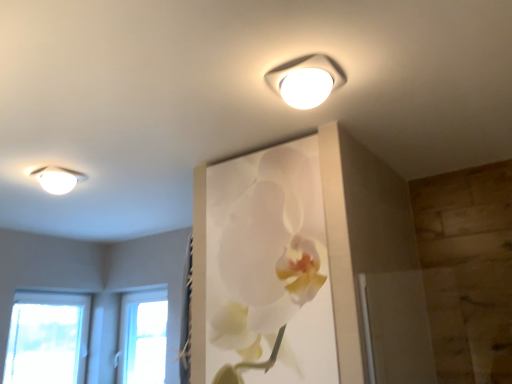
Question: Does white glossy ceiling light at upper left, marked as the 2th lamp in a top-to-bottom arrangement, turn towards white plastic lamp at upper center, placed as the 2th lamp when sorted from bottom to top?

Choices:
 (A) yes
 (B) no

Answer: (A)

Question: Is white glossy ceiling light at upper left, the 2th lamp from the front, wider than white plastic lamp at upper center, placed as the first lamp when sorted from right to left?

Choices:
 (A) no
 (B) yes

Answer: (A)

Question: From the image's perspective, is white glossy ceiling light at upper left, the second lamp in the right-to-left sequence, beneath white plastic lamp at upper center, placed as the 2th lamp when sorted from bottom to top?

Choices:
 (A) no
 (B) yes

Answer: (B)

Question: Is white glossy ceiling light at upper left, the 1th lamp when ordered from back to front, thinner than white plastic lamp at upper center, positioned as the second lamp in back-to-front order?

Choices:
 (A) no
 (B) yes

Answer: (B)

Question: Does white glossy ceiling light at upper left, the second lamp in the right-to-left sequence, come behind white plastic lamp at upper center, positioned as the second lamp in back-to-front order?

Choices:
 (A) yes
 (B) no

Answer: (A)

Question: Relative to transparent glass window at lower left, is white glossy ceiling light at upper left, which is counted as the 1th lamp, starting from the bottom, in front or behind?

Choices:
 (A) front
 (B) behind

Answer: (A)

Question: From the image's perspective, is white glossy ceiling light at upper left, the 2th lamp from the front, located above or below transparent glass window at lower left?

Choices:
 (A) below
 (B) above

Answer: (B)

Question: Based on their positions, is white glossy ceiling light at upper left, the 2th lamp from the front, located to the left or right of transparent glass window at lower left?

Choices:
 (A) right
 (B) left

Answer: (B)

Question: Is point (46, 170) closer or farther from the camera than point (151, 337)?

Choices:
 (A) closer
 (B) farther

Answer: (A)

Question: Is point (60, 192) positioned closer to the camera than point (320, 74)?

Choices:
 (A) farther
 (B) closer

Answer: (A)

Question: Based on their sizes in the image, would you say white glossy ceiling light at upper left, the 1th lamp when ordered from back to front, is bigger or smaller than white plastic lamp at upper center, the 2th lamp when ordered from left to right?

Choices:
 (A) big
 (B) small

Answer: (B)

Question: Is white glossy ceiling light at upper left, marked as the 2th lamp in a top-to-bottom arrangement, wider or thinner than white plastic lamp at upper center, the 2th lamp when ordered from left to right?

Choices:
 (A) wide
 (B) thin

Answer: (B)

Question: From a real-world perspective, is white glossy ceiling light at upper left, the second lamp in the right-to-left sequence, above or below white plastic lamp at upper center, arranged as the first lamp when viewed from the front?

Choices:
 (A) above
 (B) below

Answer: (B)

Question: In terms of height, does white plastic lamp at upper center, arranged as the first lamp when viewed from the front, look taller or shorter compared to white matte orchid at upper center?

Choices:
 (A) short
 (B) tall

Answer: (A)

Question: From the image's perspective, is white plastic lamp at upper center, arranged as the first lamp when viewed from the front, above or below white matte orchid at upper center?

Choices:
 (A) below
 (B) above

Answer: (B)